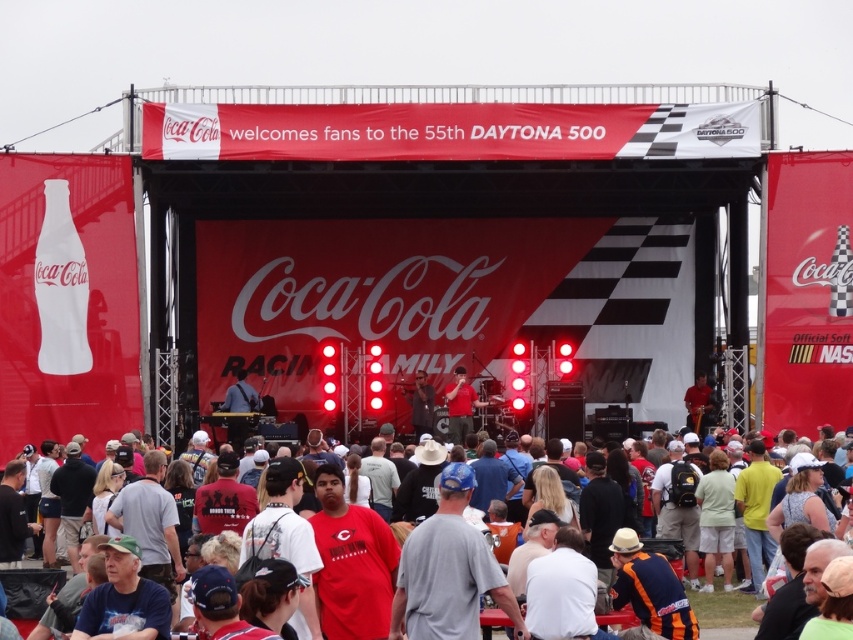
Which is below, gray fabric shirt at center or white cotton t-shirts at lower center?

white cotton t-shirts at lower center

Who is taller, gray fabric shirt at center or white cotton t-shirts at lower center?

With more height is gray fabric shirt at center.

This screenshot has height=640, width=853. What do you see at coordinates (448, 570) in the screenshot?
I see `gray fabric shirt at center` at bounding box center [448, 570].

The height and width of the screenshot is (640, 853). In order to click on gray fabric shirt at center in this screenshot , I will do (448, 570).

Find the location of a particular element. This screenshot has height=640, width=853. white cotton t-shirts at lower center is located at coordinates (722, 608).

Which is above, white cotton t-shirts at lower center or red matte shirt at center?

red matte shirt at center

Which is behind, point (724, 620) or point (461, 378)?

Positioned behind is point (461, 378).

Find the location of a particular element. Image resolution: width=853 pixels, height=640 pixels. white cotton t-shirts at lower center is located at coordinates (722, 608).

Is gray fabric shirt at center below red matte shirt at center?

Indeed, gray fabric shirt at center is positioned under red matte shirt at center.

In the scene shown: Is gray fabric shirt at center positioned behind red matte shirt at center?

No, it is in front of red matte shirt at center.

What do you see at coordinates (448, 570) in the screenshot? I see `gray fabric shirt at center` at bounding box center [448, 570].

Identify the location of gray fabric shirt at center. This screenshot has width=853, height=640. (448, 570).